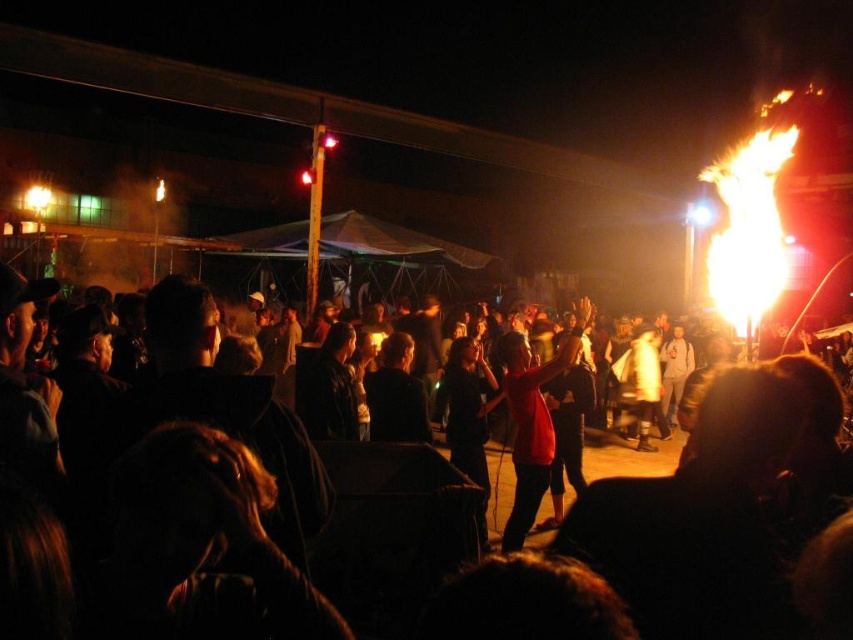
You are at the event and want to see the fire performance clearly. You notice two people wearing red shirts at the center of the crowd. Which person with a red shirt is blocking your view more? The matte red shirt at center or the red matte shirt at center?

The matte red shirt at center is in front of the red matte shirt at center, so the matte red shirt at center is blocking your view more.